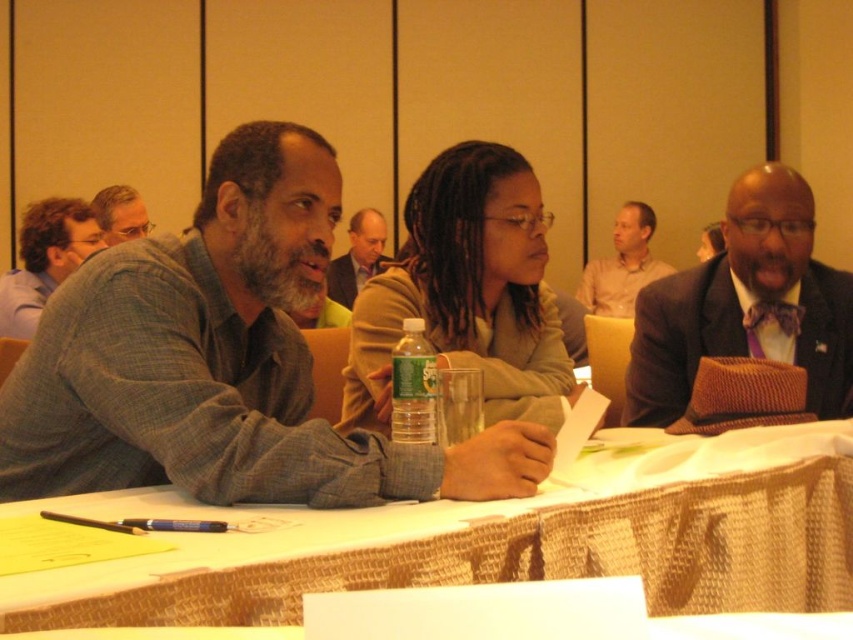
Question: Which of the following is the closest to the observer?

Choices:
 (A) (805, 328)
 (B) (614, 298)
 (C) (115, 436)

Answer: (C)

Question: Is brown textured hat at right bigger than clear plastic bottle at center?

Choices:
 (A) no
 (B) yes

Answer: (B)

Question: Which is farther from the gray flannel shirt at left?

Choices:
 (A) brown textured hat at right
 (B) clear plastic bottle at center
 (C) light brown shirt at upper center
 (D) white woven tablecloth at center

Answer: (C)

Question: Among these objects, which one is farthest from the camera?

Choices:
 (A) gray flannel shirt at center
 (B) gray plaid shirt at left

Answer: (A)

Question: Is gray plaid shirt at left positioned in front of white woven tablecloth at center?

Choices:
 (A) yes
 (B) no

Answer: (B)

Question: Can you confirm if light brown shirt at upper center is wider than matte gray shirt at left?

Choices:
 (A) yes
 (B) no

Answer: (A)